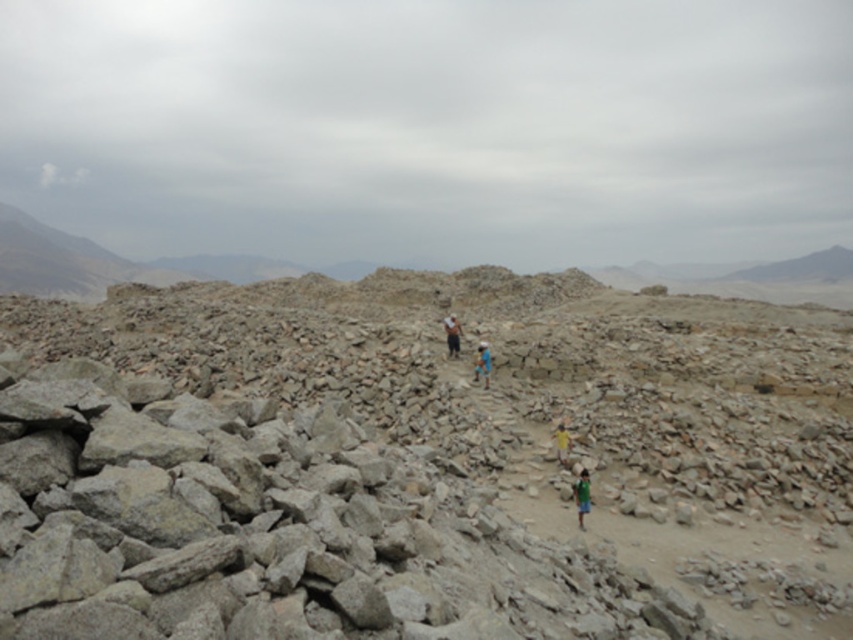
Which of these two, green fabric shirt at center or yellow fabric person at center, stands taller?

green fabric shirt at center is taller.

Does green fabric shirt at center appear on the left side of yellow fabric person at center?

Indeed, green fabric shirt at center is positioned on the left side of yellow fabric person at center.

Does point (577, 508) lie behind point (556, 435)?

That is False.

Where is `green fabric shirt at center`? green fabric shirt at center is located at coordinates (581, 496).

Identify the location of light blue fabric at center. This screenshot has width=853, height=640. (451, 333).

Who is taller, light blue fabric at center or yellow fabric person at center?

With more height is yellow fabric person at center.

Is point (450, 326) farther from camera compared to point (566, 449)?

Yes, point (450, 326) is farther from viewer.

Where is `light blue fabric at center`? This screenshot has width=853, height=640. light blue fabric at center is located at coordinates (451, 333).

Is blue fabric shirt at center smaller than yellow fabric person at center?

Incorrect, blue fabric shirt at center is not smaller in size than yellow fabric person at center.

Does blue fabric shirt at center have a larger size compared to yellow fabric person at center?

Indeed, blue fabric shirt at center has a larger size compared to yellow fabric person at center.

The height and width of the screenshot is (640, 853). What are the coordinates of `blue fabric shirt at center` in the screenshot? It's located at (482, 364).

Find the location of a particular element. This screenshot has height=640, width=853. blue fabric shirt at center is located at coordinates (482, 364).